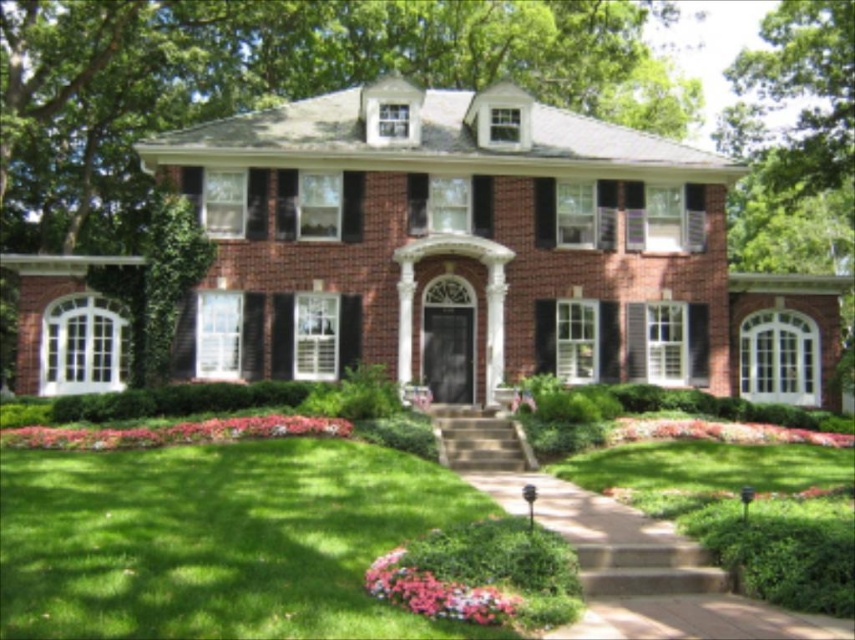
Identify the location of green leafy tree at upper center. (275, 81).

You are a GUI agent. You are given a task and a screenshot of the screen. Output one action in this format:
    pyautogui.click(x=<x>, y=<y>)
    Task: Click on the green leafy tree at upper center
    The width and height of the screenshot is (855, 640).
    Given the screenshot: What is the action you would take?
    pyautogui.click(x=275, y=81)

Does green leafy tree at upper center have a smaller size compared to pink floral bed at lower right?

No, green leafy tree at upper center is not smaller than pink floral bed at lower right.

Is green leafy tree at upper center to the left of pink floral bed at lower right from the viewer's perspective?

Indeed, green leafy tree at upper center is positioned on the left side of pink floral bed at lower right.

Locate an element on the screen. This screenshot has width=855, height=640. green leafy tree at upper center is located at coordinates (275, 81).

This screenshot has height=640, width=855. Identify the location of green leafy tree at upper center. (275, 81).

Between pink matte flowers at lower left and pastel floral carpet at lower center, which one has more height?

Standing taller between the two is pink matte flowers at lower left.

Is pink matte flowers at lower left positioned at the back of pastel floral carpet at lower center?

That is True.

Identify the location of pink matte flowers at lower left. (174, 433).